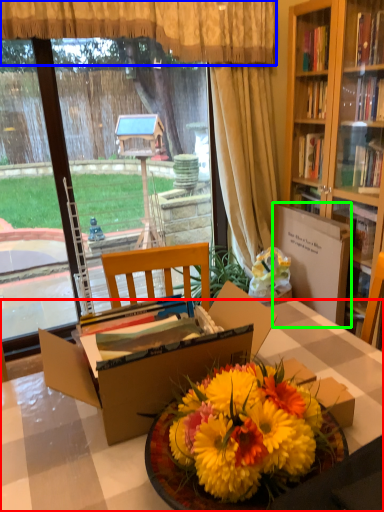
Question: Which object is the farthest from desk (highlighted by a red box)? Choose among these: curtain (highlighted by a blue box) or cardboard box (highlighted by a green box).

Choices:
 (A) curtain
 (B) cardboard box

Answer: (A)